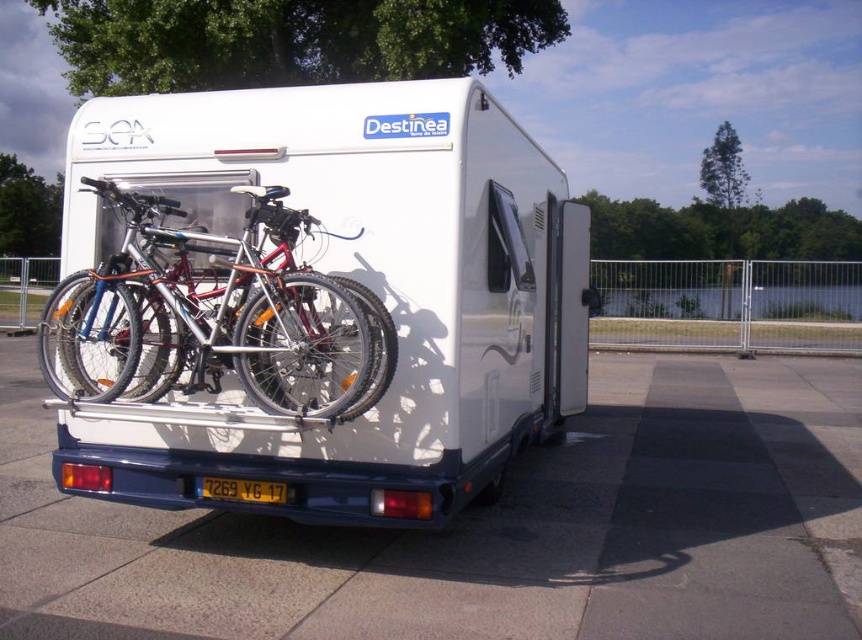
You are standing in front of the white caravan and want to take a photo of it. The camera you are using has a maximum focus range of 3 meters. Will the white glossy van at center be in focus?

The white glossy van at center is 3.86 meters away from the camera, which exceeds the maximum focus range of 3 meters. Therefore, the van will not be in focus.

You are a delivery person who needs to attach a GPS tracker to the white glossy van at center. The GPS tracker must be placed at least 5 feet away from the yellow matte license plate at center to avoid signal interference. Based on the scene description, can you safely attach the GPS tracker on the van?

The white glossy van at center is only 4.78 feet away from the yellow matte license plate at center. Since the required distance is at least 5 feet, the GPS tracker cannot be safely attached at this location without risking signal interference.